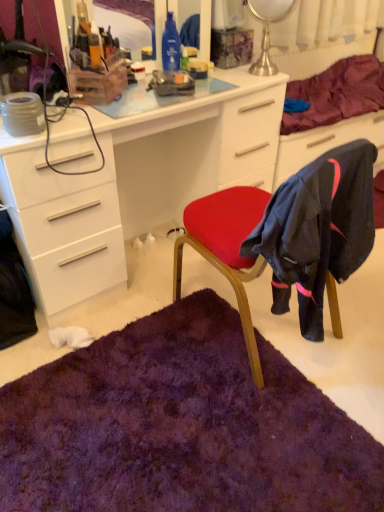
Question: Does purple shaggy rug at lower center come behind velvet red chair at center?

Choices:
 (A) yes
 (B) no

Answer: (B)

Question: Can you confirm if purple shaggy rug at lower center is taller than velvet red chair at center?

Choices:
 (A) yes
 (B) no

Answer: (B)

Question: From the image's perspective, is purple shaggy rug at lower center under velvet red chair at center?

Choices:
 (A) yes
 (B) no

Answer: (A)

Question: From a real-world perspective, is purple shaggy rug at lower center positioned under velvet red chair at center based on gravity?

Choices:
 (A) yes
 (B) no

Answer: (A)

Question: Does purple shaggy rug at lower center have a lesser width compared to velvet red chair at center?

Choices:
 (A) no
 (B) yes

Answer: (A)

Question: Can you confirm if purple shaggy rug at lower center is bigger than velvet red chair at center?

Choices:
 (A) yes
 (B) no

Answer: (B)

Question: Can you confirm if purple shaggy rug at lower center is positioned to the right of purple soft fabric at upper right?

Choices:
 (A) no
 (B) yes

Answer: (A)

Question: Is purple shaggy rug at lower center located outside purple soft fabric at upper right?

Choices:
 (A) yes
 (B) no

Answer: (A)

Question: Would you say purple soft fabric at upper right is part of purple shaggy rug at lower center's contents?

Choices:
 (A) yes
 (B) no

Answer: (B)

Question: Is purple shaggy rug at lower center smaller than purple soft fabric at upper right?

Choices:
 (A) yes
 (B) no

Answer: (A)

Question: From the image's perspective, would you say purple shaggy rug at lower center is positioned over purple soft fabric at upper right?

Choices:
 (A) no
 (B) yes

Answer: (A)

Question: Is purple shaggy rug at lower center aimed at purple soft fabric at upper right?

Choices:
 (A) yes
 (B) no

Answer: (B)

Question: Is purple shaggy rug at lower center located within purple soft fabric at upper right?

Choices:
 (A) no
 (B) yes

Answer: (A)